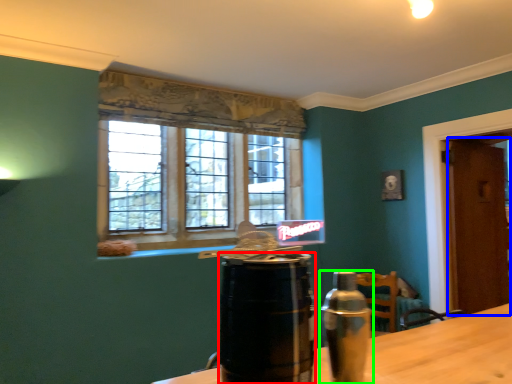
Question: Considering the real-world distances, which object is closest to beverage (highlighted by a red box)? door (highlighted by a blue box) or bottle (highlighted by a green box).

Choices:
 (A) door
 (B) bottle

Answer: (B)